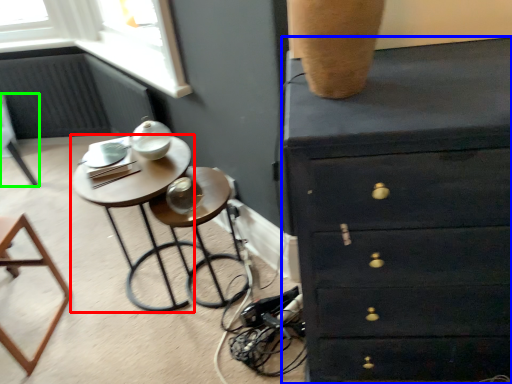
Question: Which object is the closest to the table (highlighted by a red box)? Choose among these: chest of drawers (highlighted by a blue box) or furniture (highlighted by a green box).

Choices:
 (A) chest of drawers
 (B) furniture

Answer: (A)